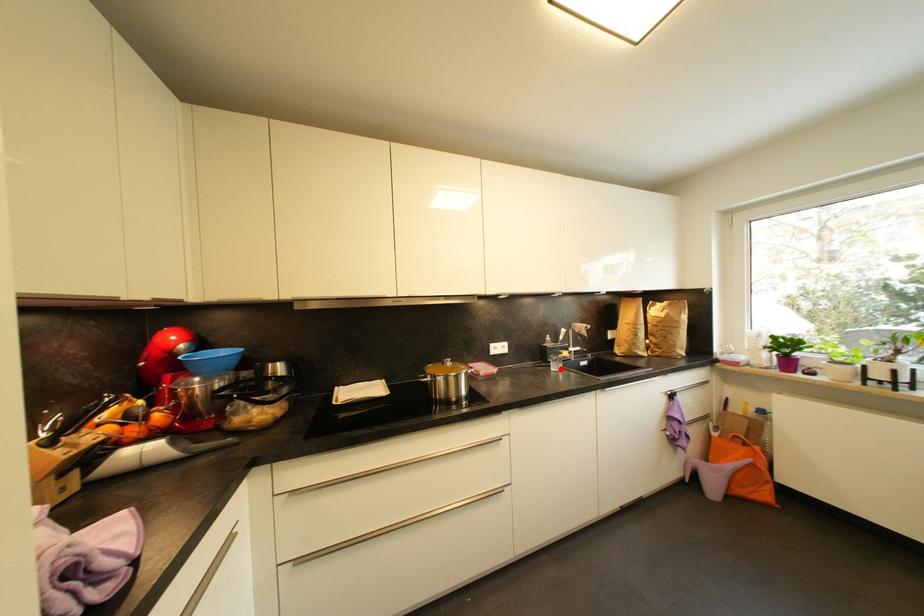
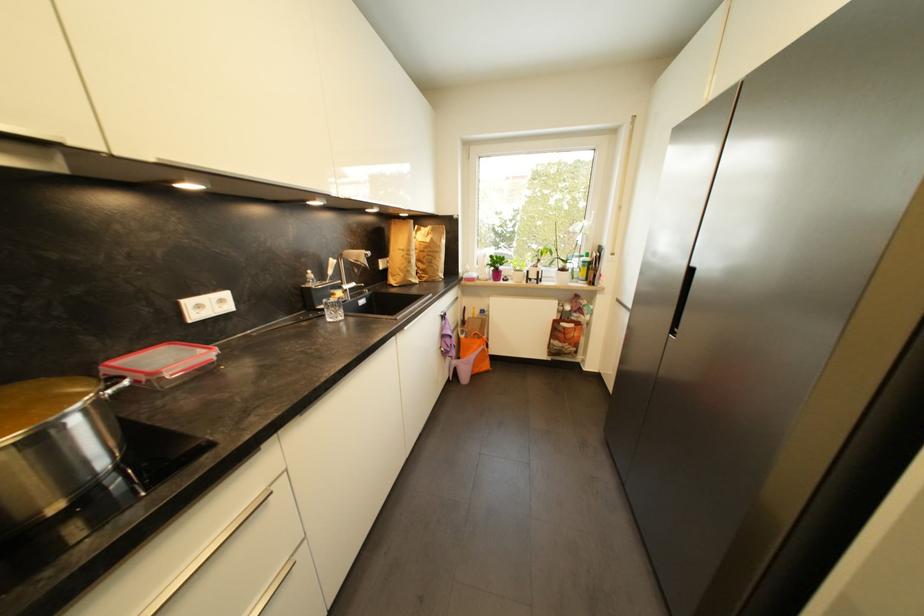
Question: I am providing you with two images of the same scene from different viewpoints. A red point is marked on the first image. At the location where the point appears in image 1, is it still visible in image 2?

Choices:
 (A) Yes
 (B) No

Answer: (A)